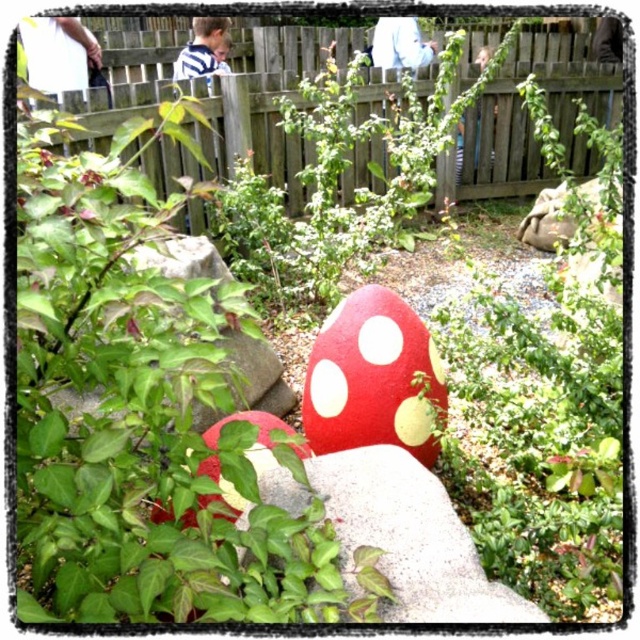
Question: Which object is farther from the camera taking this photo?

Choices:
 (A) red matte mushroom at center
 (B) wooden fence at upper center

Answer: (B)

Question: Can you confirm if red matte mushroom at center is positioned to the left of green matte rock at center-left?

Choices:
 (A) no
 (B) yes

Answer: (A)

Question: Estimate the real-world distances between objects in this image. Which object is closer to the wooden fence at upper center?

Choices:
 (A) red matte mushroom at center
 (B) green matte rock at center-left

Answer: (B)

Question: Is wooden fence at upper center positioned behind green matte rock at center-left?

Choices:
 (A) yes
 (B) no

Answer: (A)

Question: Is wooden fence at upper center thinner than red matte mushroom at center?

Choices:
 (A) yes
 (B) no

Answer: (B)

Question: Which point appears closest to the camera in this image?

Choices:
 (A) (563, 52)
 (B) (340, 385)

Answer: (B)